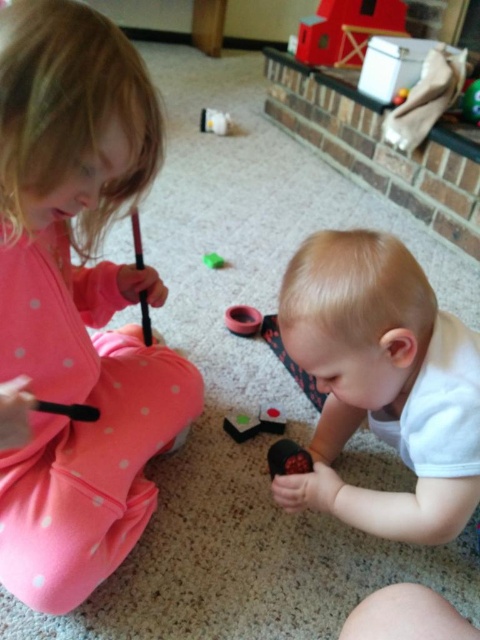
Can you confirm if matte pink pajamas at left is bigger than white matte baby at lower center?

Correct, matte pink pajamas at left is larger in size than white matte baby at lower center.

Is the position of matte pink pajamas at left less distant than that of white matte baby at lower center?

Yes, it is in front of white matte baby at lower center.

Where is `matte pink pajamas at left`? matte pink pajamas at left is located at coordinates (x=76, y=301).

Which of these two, matte pink pajamas at left or rubber ring at center, stands taller?

With more height is matte pink pajamas at left.

This screenshot has height=640, width=480. What do you see at coordinates (76, 301) in the screenshot?
I see `matte pink pajamas at left` at bounding box center [76, 301].

Is point (108, 204) farther from viewer compared to point (254, 333)?

No, (108, 204) is closer to viewer.

This screenshot has width=480, height=640. Identify the location of matte pink pajamas at left. (76, 301).

Is smooth plastic toy at center to the right of green rubber toy at center from the viewer's perspective?

Yes, smooth plastic toy at center is to the right of green rubber toy at center.

Is smooth plastic toy at center in front of green rubber toy at center?

Yes.

This screenshot has width=480, height=640. I want to click on smooth plastic toy at center, so click(240, 426).